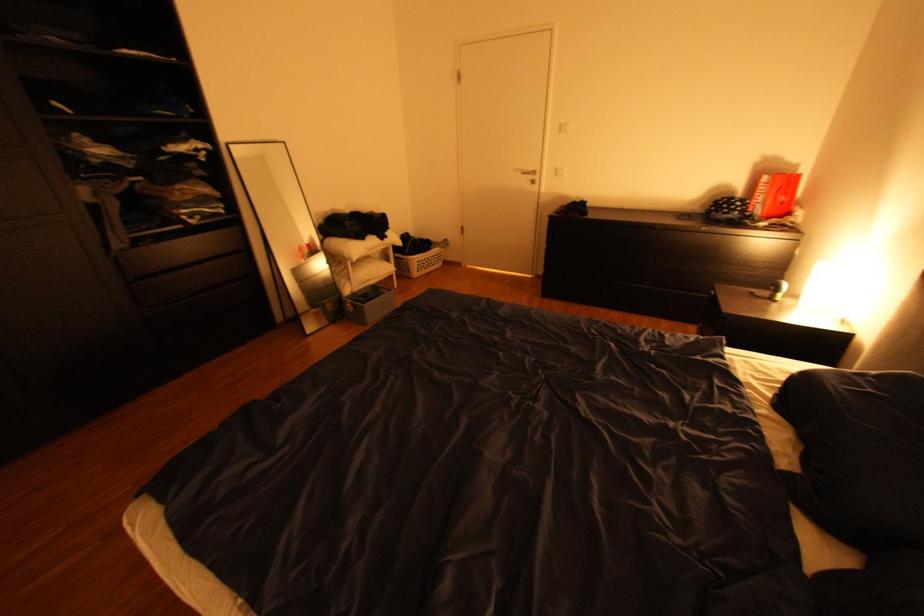
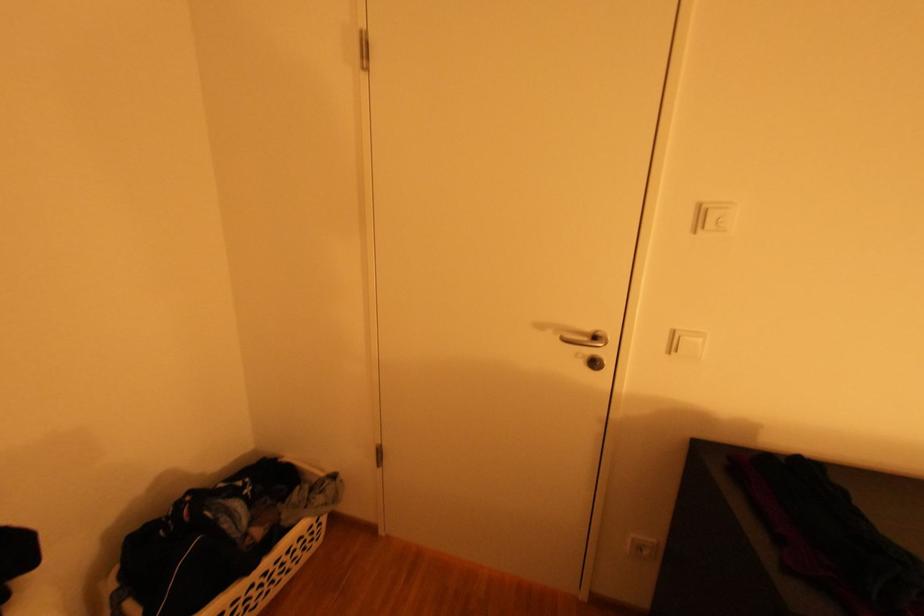
Question: The images are taken continuously from a first-person perspective. In which direction are you moving?

Choices:
 (A) Left
 (B) Right
 (C) Forward
 (D) Backward

Answer: (C)